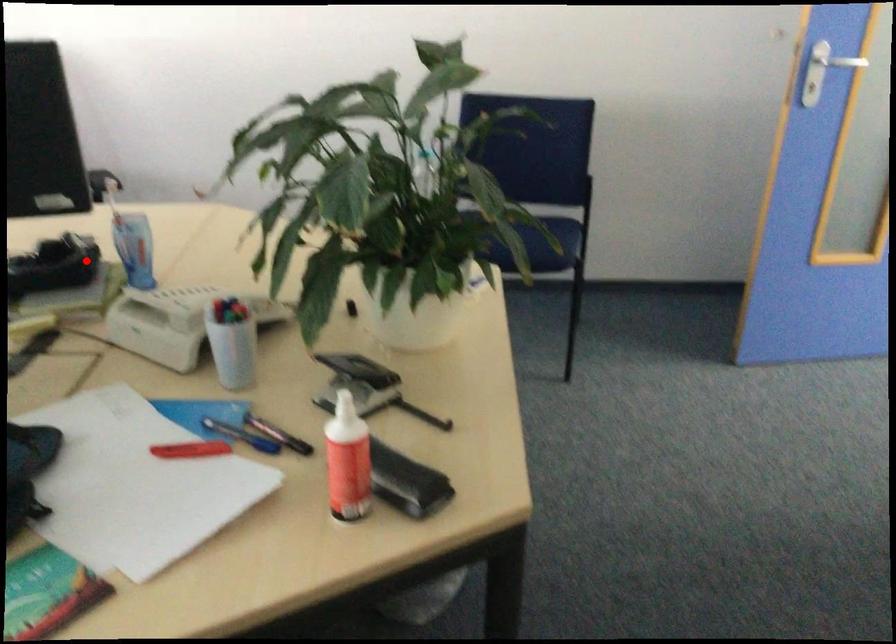
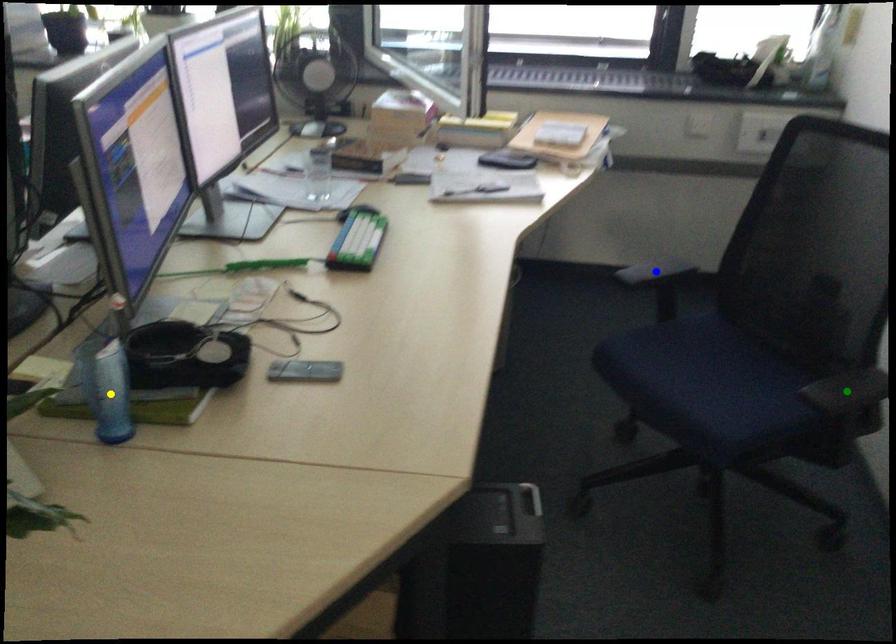
Question: I am providing you with two images of the same scene from different viewpoints. A red point is marked on the first image. You are given multiple points on the second image. Can you choose the point in image 2 that corresponds to the point in image 1?

Choices:
 (A) green point
 (B) yellow point
 (C) blue point

Answer: (B)